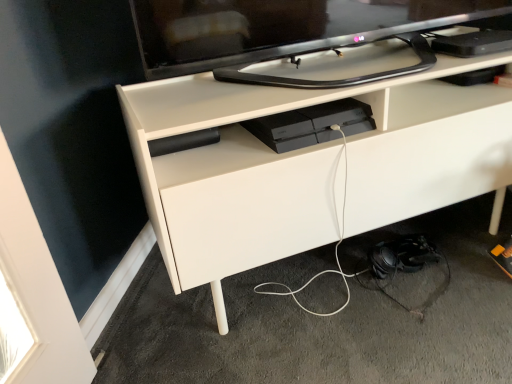
Question: Does black glossy tv at upper center have a greater height compared to white matte cable at lower center?

Choices:
 (A) no
 (B) yes

Answer: (B)

Question: Is black glossy tv at upper center positioned far away from white matte cable at lower center?

Choices:
 (A) no
 (B) yes

Answer: (A)

Question: Can you confirm if black glossy tv at upper center is shorter than white matte cable at lower center?

Choices:
 (A) no
 (B) yes

Answer: (A)

Question: Is black glossy tv at upper center thinner than white matte cable at lower center?

Choices:
 (A) no
 (B) yes

Answer: (B)

Question: Can you see black glossy tv at upper center touching white matte cable at lower center?

Choices:
 (A) no
 (B) yes

Answer: (A)

Question: Is black glossy tv at upper center outside white matte cable at lower center?

Choices:
 (A) yes
 (B) no

Answer: (A)

Question: Considering the relative sizes of black glossy tv at upper center and satin black console at center in the image provided, is black glossy tv at upper center taller than satin black console at center?

Choices:
 (A) yes
 (B) no

Answer: (A)

Question: Is black glossy tv at upper center oriented away from satin black console at center?

Choices:
 (A) yes
 (B) no

Answer: (B)

Question: From the image's perspective, is black glossy tv at upper center located beneath satin black console at center?

Choices:
 (A) yes
 (B) no

Answer: (B)

Question: From the image's perspective, is black glossy tv at upper center located above satin black console at center?

Choices:
 (A) yes
 (B) no

Answer: (A)

Question: Can you confirm if black glossy tv at upper center is positioned to the right of satin black console at center?

Choices:
 (A) no
 (B) yes

Answer: (B)

Question: Are black glossy tv at upper center and satin black console at center beside each other?

Choices:
 (A) no
 (B) yes

Answer: (A)

Question: Would you say white matte desk at center is part of satin black console at center's contents?

Choices:
 (A) no
 (B) yes

Answer: (A)